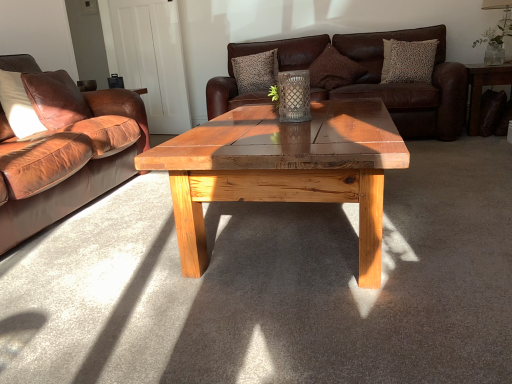
Question: From the image's perspective, is clear glass vase at upper right beneath brown leather couch at left, marked as the 1th studio couch in a left-to-right arrangement?

Choices:
 (A) yes
 (B) no

Answer: (B)

Question: Is clear glass vase at upper right touching brown leather couch at left, marked as the 1th studio couch in a left-to-right arrangement?

Choices:
 (A) yes
 (B) no

Answer: (B)

Question: Could you tell me if clear glass vase at upper right is turned towards brown leather couch at left, which is the first studio couch in front-to-back order?

Choices:
 (A) yes
 (B) no

Answer: (B)

Question: Would you say clear glass vase at upper right is a long distance from brown leather couch at left, which is the first studio couch in front-to-back order?

Choices:
 (A) no
 (B) yes

Answer: (B)

Question: Does clear glass vase at upper right come behind brown leather couch at left, which is the first studio couch in front-to-back order?

Choices:
 (A) yes
 (B) no

Answer: (A)

Question: Is point (71, 81) closer or farther from the camera than point (420, 77)?

Choices:
 (A) farther
 (B) closer

Answer: (B)

Question: From the image's perspective, is leather pillow at left, the fourth pillow viewed from the back, positioned above or below patterned fabric pillow at upper right, the 2th pillow when ordered from front to back?

Choices:
 (A) below
 (B) above

Answer: (A)

Question: From their relative heights in the image, would you say leather pillow at left, placed as the 1th pillow when sorted from left to right, is taller or shorter than patterned fabric pillow at upper right, the 1th pillow in the right-to-left sequence?

Choices:
 (A) tall
 (B) short

Answer: (B)

Question: Based on their positions, is leather pillow at left, placed as the 1th pillow when sorted from left to right, located to the left or right of patterned fabric pillow at upper right, which is the 4th pillow from left to right?

Choices:
 (A) left
 (B) right

Answer: (A)

Question: From the image's perspective, is dark brown leather side table at right located above or below matte white lampshade at upper right?

Choices:
 (A) above
 (B) below

Answer: (B)

Question: Do you think dark brown leather side table at right is within matte white lampshade at upper right, or outside of it?

Choices:
 (A) outside
 (B) inside

Answer: (A)

Question: In terms of height, does dark brown leather side table at right look taller or shorter compared to matte white lampshade at upper right?

Choices:
 (A) tall
 (B) short

Answer: (A)

Question: Looking at their shapes, would you say dark brown leather side table at right is wider or thinner than matte white lampshade at upper right?

Choices:
 (A) wide
 (B) thin

Answer: (A)

Question: From a real-world perspective, is leather pillow at left, which is the 1th pillow from front to back, above or below brown leather couch at left, marked as the 1th studio couch in a left-to-right arrangement?

Choices:
 (A) below
 (B) above

Answer: (B)

Question: Considering their positions, is leather pillow at left, which is the 1th pillow from front to back, located in front of or behind brown leather couch at left, the 2th studio couch from the back?

Choices:
 (A) behind
 (B) front

Answer: (A)